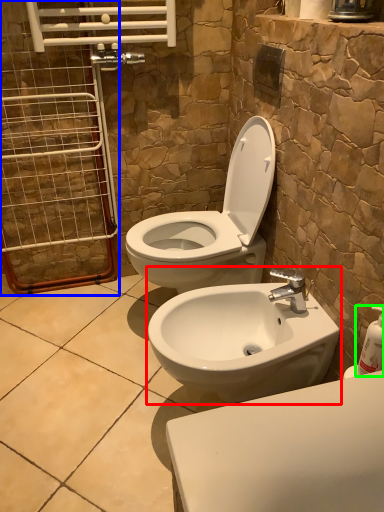
Question: Considering the real-world distances, which object is farthest from sink (highlighted by a red box)? screen door (highlighted by a blue box) or soap dispenser (highlighted by a green box)?

Choices:
 (A) screen door
 (B) soap dispenser

Answer: (A)